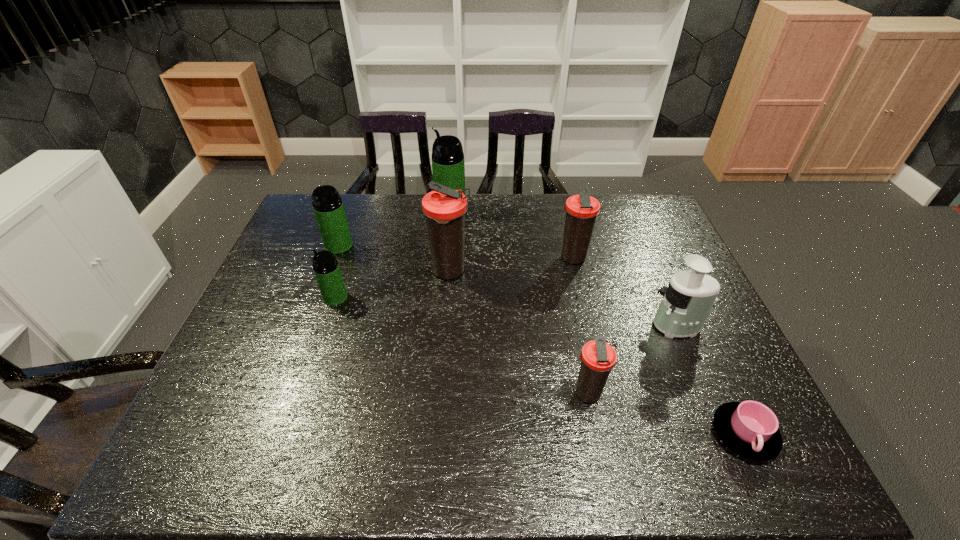
Locate an element on the screen. The image size is (960, 540). pink cup is located at coordinates (749, 428).

Locate an element on the screen. The image size is (960, 540). the shortest object is located at coordinates (749, 428).

Locate an element on the screen. This screenshot has height=540, width=960. vacant space positioned on the back of the leftmost brown thermos bottle is located at coordinates (455, 205).

The width and height of the screenshot is (960, 540). What are the coordinates of `vacant region located 0.290m from the spout of the farthest green thermos bottle` in the screenshot? It's located at (353, 207).

Locate an element on the screen. This screenshot has height=540, width=960. free space located from the spout of the farthest green thermos bottle is located at coordinates (x=413, y=207).

In order to click on vacant space located from the spout of the farthest green thermos bottle in this screenshot , I will do `click(398, 207)`.

Find the location of a particular element. vacant area situated 0.090m from the spout of the second biggest green thermos bottle is located at coordinates 328,274.

Where is `free point located 0.120m on the back of the second smallest brown thermos bottle`? This screenshot has height=540, width=960. free point located 0.120m on the back of the second smallest brown thermos bottle is located at coordinates (564, 225).

Where is `vacant space situated on the front of the juicer`? vacant space situated on the front of the juicer is located at coordinates (693, 362).

Find the location of a particular element. The image size is (960, 540). free spot located from the spout of the fifth farthest object is located at coordinates (306, 298).